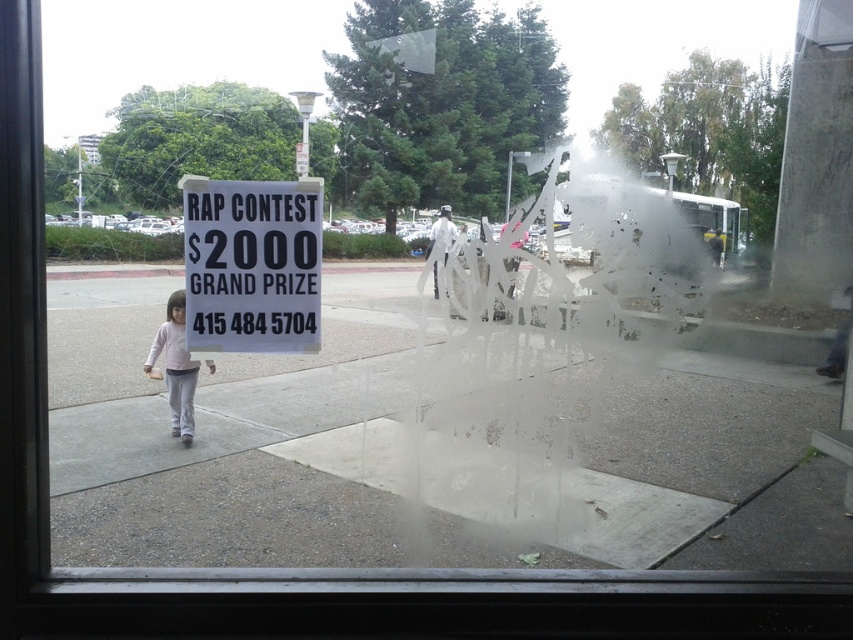
Question: Can you confirm if white paper sign at center is positioned to the right of light pink fabric child at lower left?

Choices:
 (A) no
 (B) yes

Answer: (B)

Question: Observing the image, what is the correct spatial positioning of white paper sign at center in reference to light pink fabric child at lower left?

Choices:
 (A) above
 (B) below

Answer: (A)

Question: Which object is closer to the camera taking this photo?

Choices:
 (A) white paper sign at center
 (B) light pink fabric child at lower left

Answer: (A)

Question: Which point is farther to the camera?

Choices:
 (A) (270, 196)
 (B) (183, 406)

Answer: (B)

Question: Does white paper sign at center appear under light pink fabric child at lower left?

Choices:
 (A) no
 (B) yes

Answer: (A)